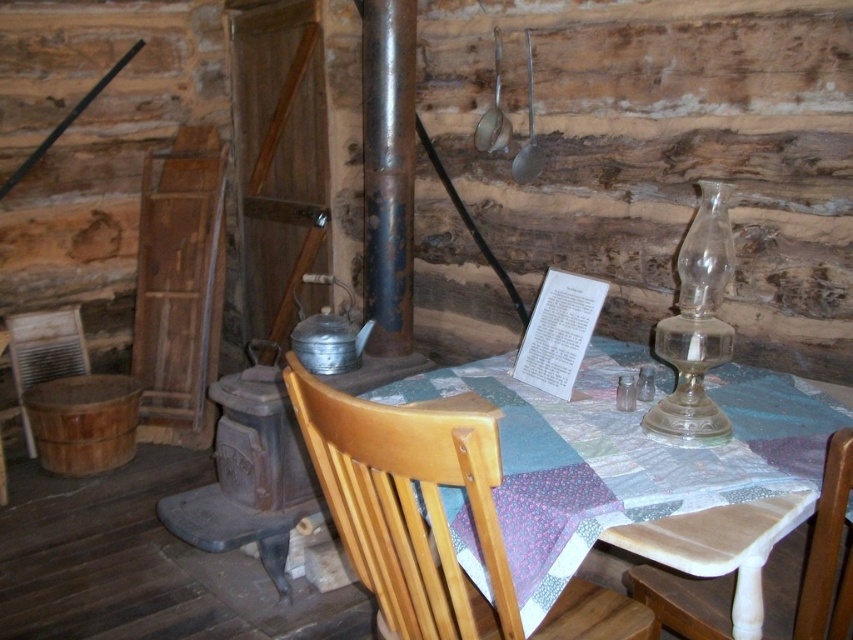
Question: Which point is closer to the camera taking this photo?

Choices:
 (A) [x=387, y=588]
 (B) [x=695, y=632]
 (C) [x=456, y=493]

Answer: (A)

Question: Which object is farther from the camera taking this photo?

Choices:
 (A) light brown wood chair at center
 (B) quilted fabric table at center
 (C) wooden chair at center

Answer: (B)

Question: Does wooden chair at center have a greater width compared to light brown wood chair at center?

Choices:
 (A) yes
 (B) no

Answer: (A)

Question: Is wooden chair at center further to the viewer compared to light brown wood chair at center?

Choices:
 (A) yes
 (B) no

Answer: (B)

Question: Considering the relative positions of wooden chair at center and light brown wood chair at center in the image provided, where is wooden chair at center located with respect to light brown wood chair at center?

Choices:
 (A) left
 (B) right

Answer: (A)

Question: Considering the real-world distances, which object is closest to the wooden chair at center?

Choices:
 (A) quilted fabric table at center
 (B) light brown wood chair at center

Answer: (A)